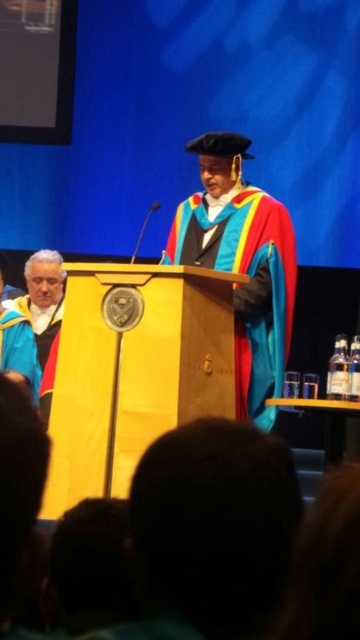
Can you confirm if velvet-like multicolored graduation gown at center is positioned to the right of blue velvet robe at left?

Indeed, velvet-like multicolored graduation gown at center is positioned on the right side of blue velvet robe at left.

Which is in front, point (239, 387) or point (14, 356)?

Positioned in front is point (239, 387).

Who is more forward, (281, 371) or (34, 396)?

Point (281, 371) is more forward.

Locate an element on the screen. The height and width of the screenshot is (640, 360). velvet-like multicolored graduation gown at center is located at coordinates (250, 278).